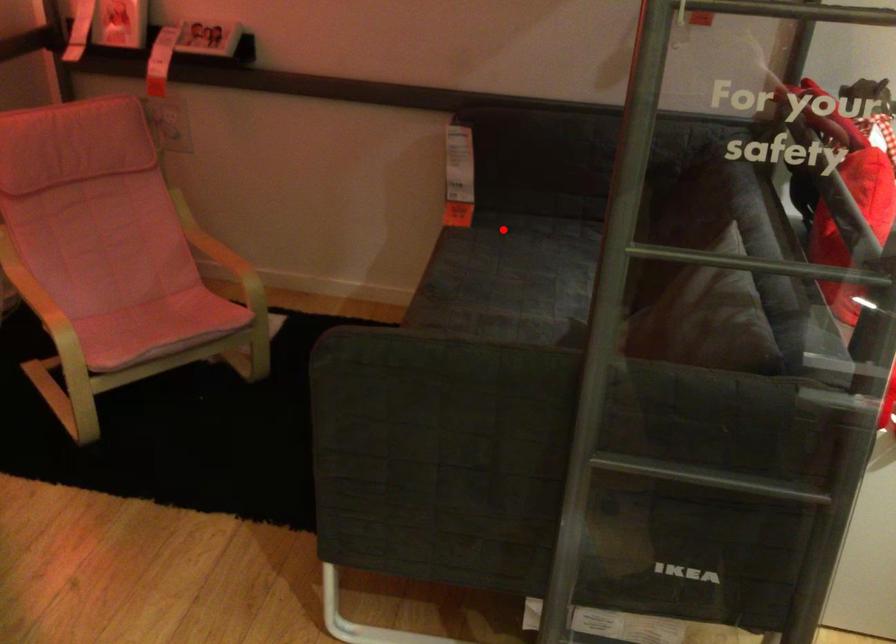
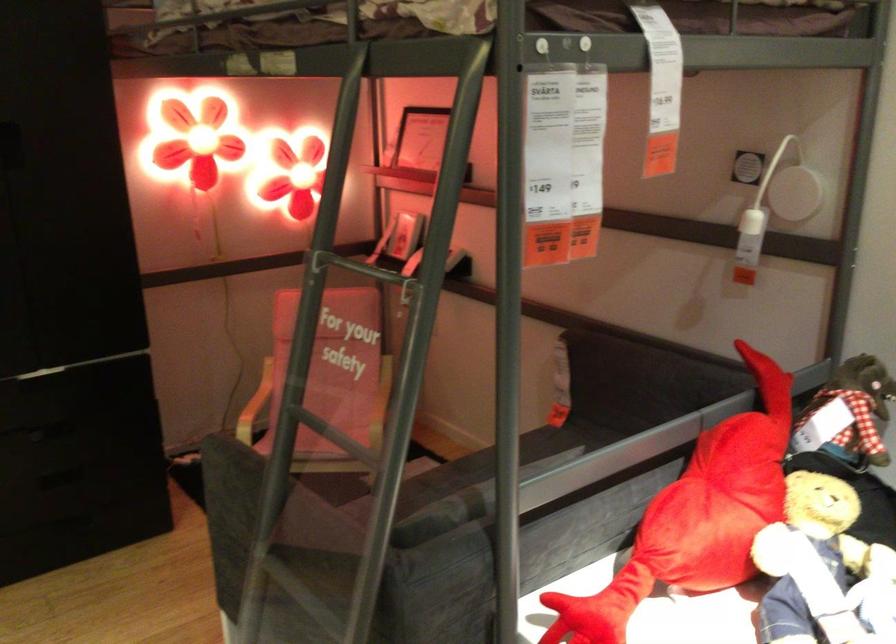
The point at the highlighted location is marked in the first image. Where is the corresponding point in the second image?

(567, 437)